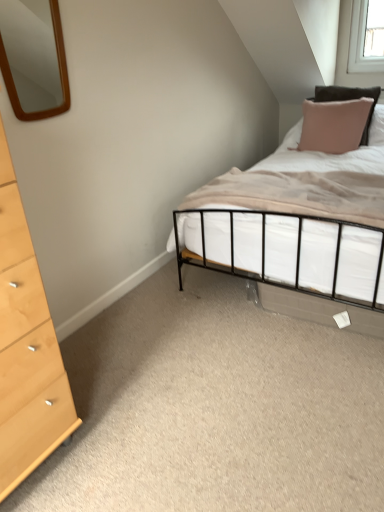
Where is `vacant space to the right of light wood/texture chest of drawers at left`? The width and height of the screenshot is (384, 512). vacant space to the right of light wood/texture chest of drawers at left is located at coordinates (110, 439).